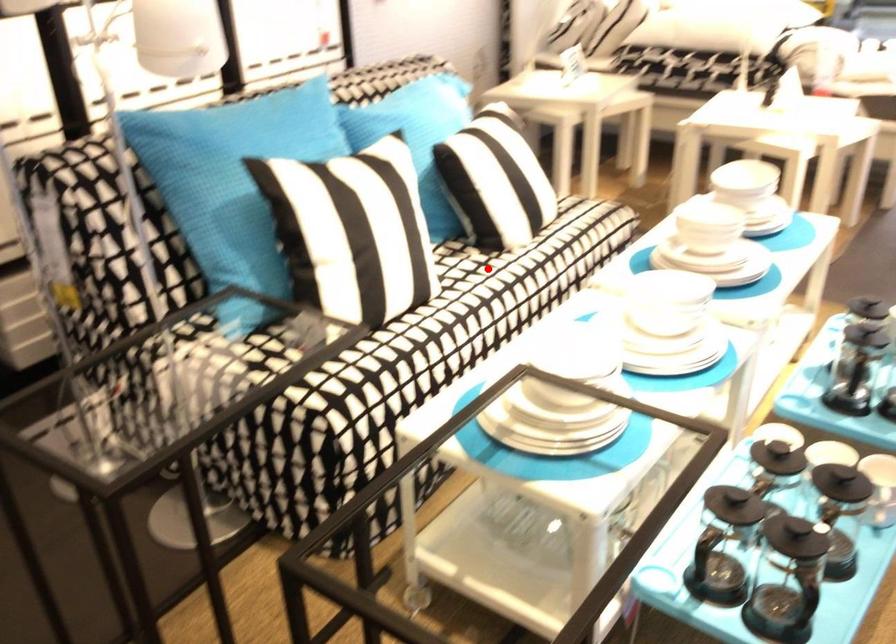
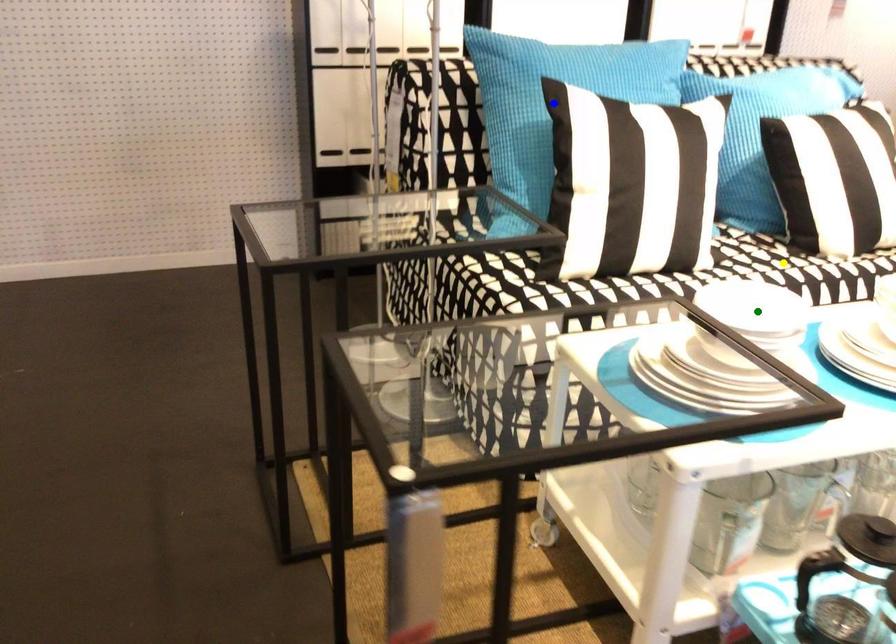
Question: I am providing you with two images of the same scene from different viewpoints. A red point is marked on the first image. You are given multiple points on the second image. Which mark in image 2 goes with the point in image 1?

Choices:
 (A) blue point
 (B) yellow point
 (C) green point

Answer: (B)